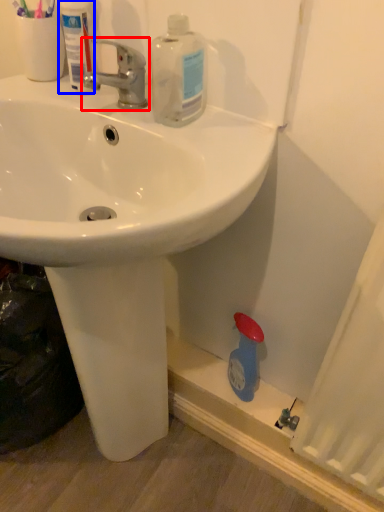
Question: Which of the following is the closest to the observer, tap (highlighted by a red box) or mouthwash (highlighted by a blue box)?

Choices:
 (A) tap
 (B) mouthwash

Answer: (A)